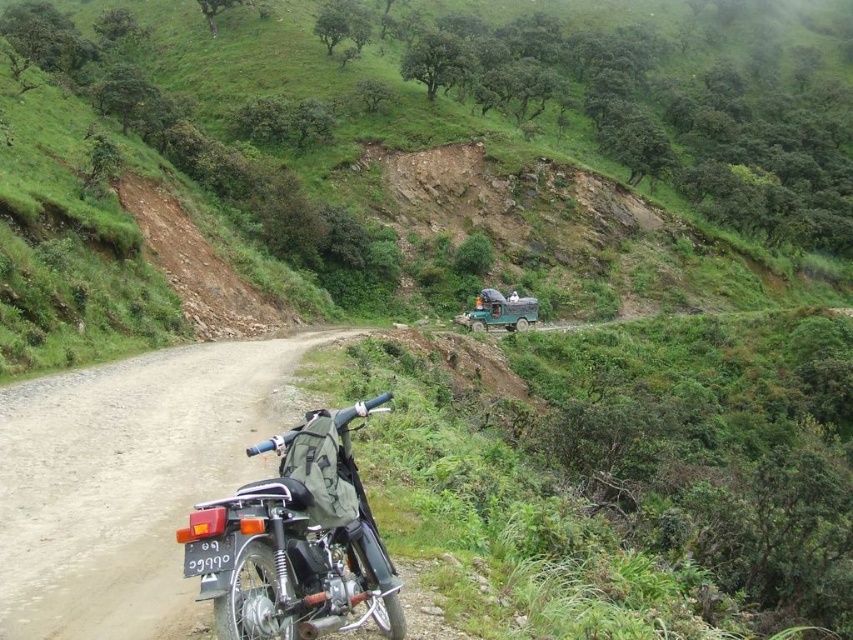
Does dirt/gravel road at lower left have a lesser height compared to green matte truck at center?

Yes.

Based on the photo, how far apart are dirt/gravel road at lower left and green matte truck at center?

36.40 meters

The height and width of the screenshot is (640, 853). What are the coordinates of `dirt/gravel road at lower left` in the screenshot? It's located at (126, 481).

You are a GUI agent. You are given a task and a screenshot of the screen. Output one action in this format:
    pyautogui.click(x=<x>, y=<y>)
    Task: Click on the shiny black motorcycle at center
    The height and width of the screenshot is (640, 853).
    Given the screenshot: What is the action you would take?
    pyautogui.click(x=294, y=541)

Who is positioned more to the left, shiny black motorcycle at center or green matte truck at center?

shiny black motorcycle at center is more to the left.

The height and width of the screenshot is (640, 853). Identify the location of shiny black motorcycle at center. [x=294, y=541].

Is dirt/gravel road at lower left below shiny black motorcycle at center?

Correct, dirt/gravel road at lower left is located below shiny black motorcycle at center.

Based on the photo, between dirt/gravel road at lower left and shiny black motorcycle at center, which one is positioned lower?

dirt/gravel road at lower left is lower down.

In order to click on dirt/gravel road at lower left in this screenshot , I will do `click(126, 481)`.